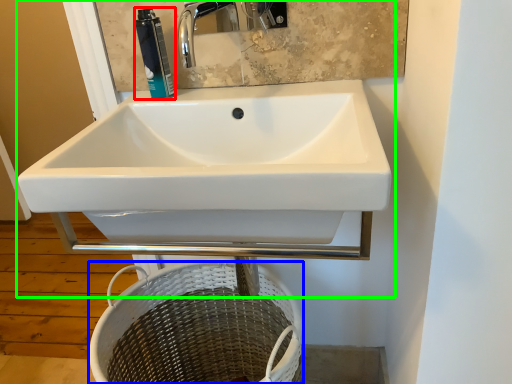
Question: Which object is the farthest from toiletry (highlighted by a red box)? Choose among these: basket (highlighted by a blue box) or sink (highlighted by a green box).

Choices:
 (A) basket
 (B) sink

Answer: (A)